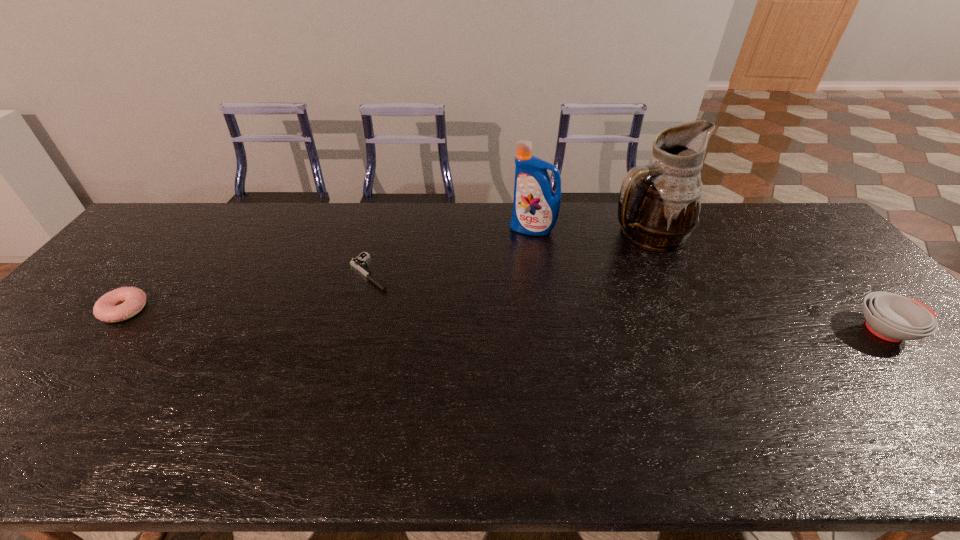
Where is `vacant area situated 0.260m on the front-facing side of the shortest object`? The width and height of the screenshot is (960, 540). vacant area situated 0.260m on the front-facing side of the shortest object is located at coordinates (443, 335).

Image resolution: width=960 pixels, height=540 pixels. I want to click on detergent at the far edge, so click(536, 206).

You are a GUI agent. You are given a task and a screenshot of the screen. Output one action in this format:
    pyautogui.click(x=<x>, y=<y>)
    Task: Click on the pitcher at the far edge
    
    Given the screenshot: What is the action you would take?
    pyautogui.click(x=659, y=203)

The height and width of the screenshot is (540, 960). I want to click on object located in the left edge section of the desktop, so click(120, 304).

You are a GUI agent. You are given a task and a screenshot of the screen. Output one action in this format:
    pyautogui.click(x=<x>, y=<y>)
    Task: Click on the object that is at the right edge
    This screenshot has height=540, width=960.
    Given the screenshot: What is the action you would take?
    pyautogui.click(x=892, y=317)

Locate an element on the screen. vacant area at the far edge of the desktop is located at coordinates (345, 242).

In the image, there is a desktop. In order to click on free region at the near edge in this screenshot , I will do `click(453, 387)`.

In order to click on free space at the left edge of the desktop in this screenshot , I will do `click(59, 354)`.

In the image, there is a desktop. Identify the location of vacant area at the right edge. This screenshot has width=960, height=540. (821, 295).

This screenshot has width=960, height=540. Find the location of `vacant space at the far left corner of the desktop`. vacant space at the far left corner of the desktop is located at coordinates (194, 218).